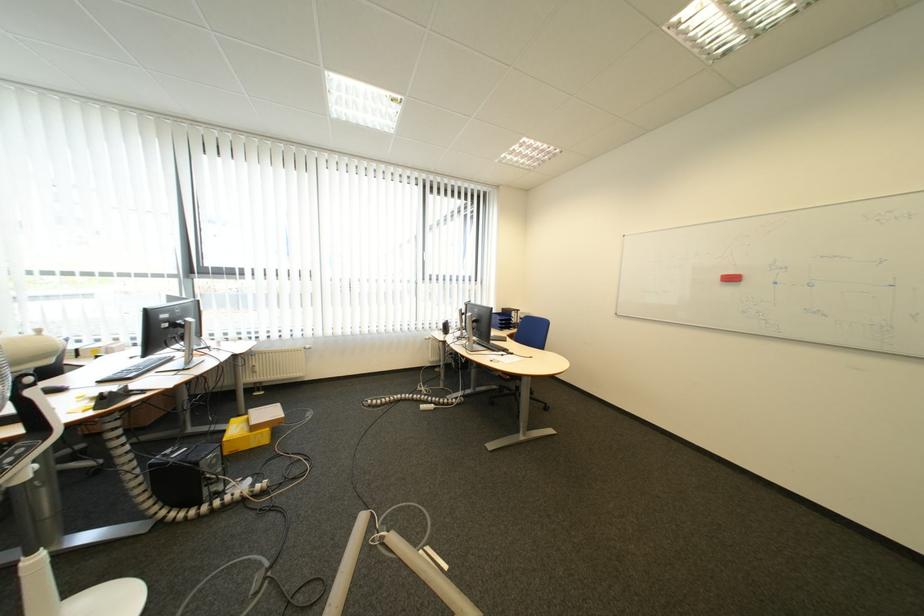
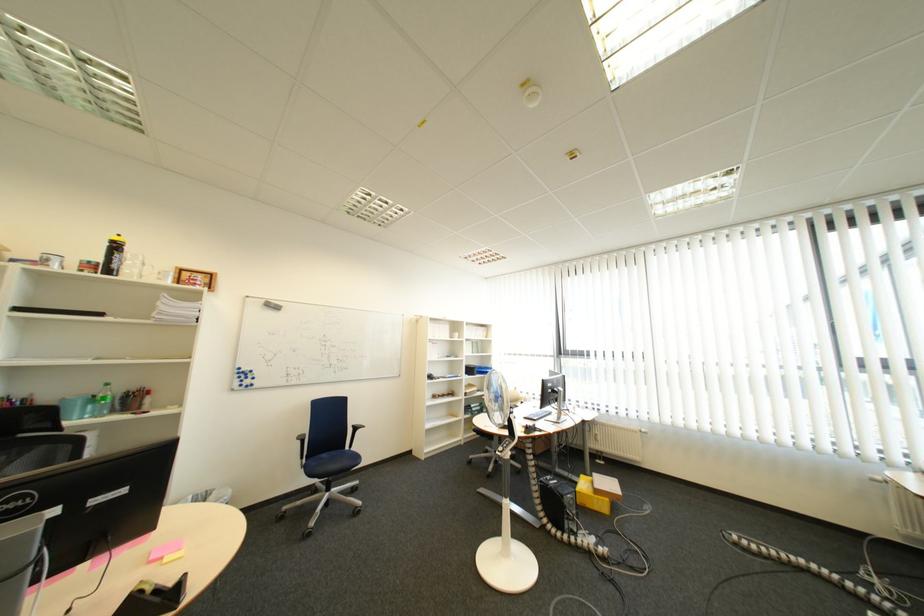
In the second image, find the point that corresponds to point 226,463 in the first image.

(585, 503)